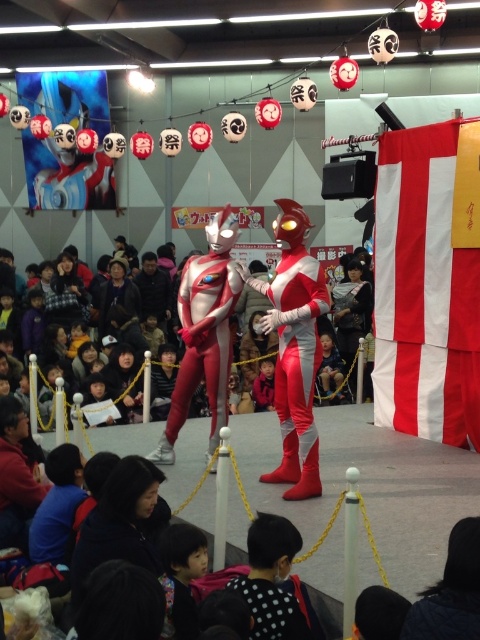
You are standing at the camera position and want to know how far the point at coordinates (465, 385) is from you. Can you determine the distance?

The point at coordinates (465, 385) is 6.98 meters away from the camera.